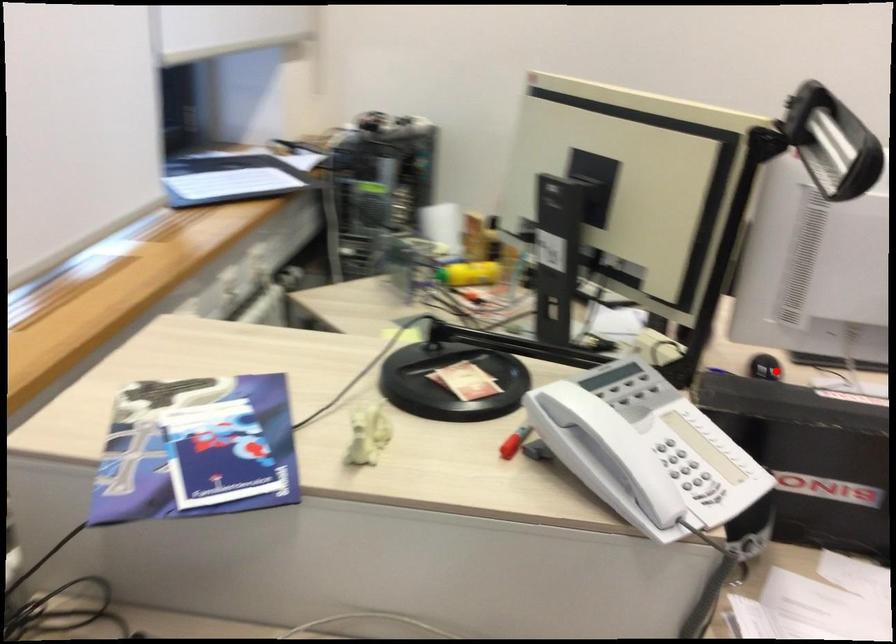
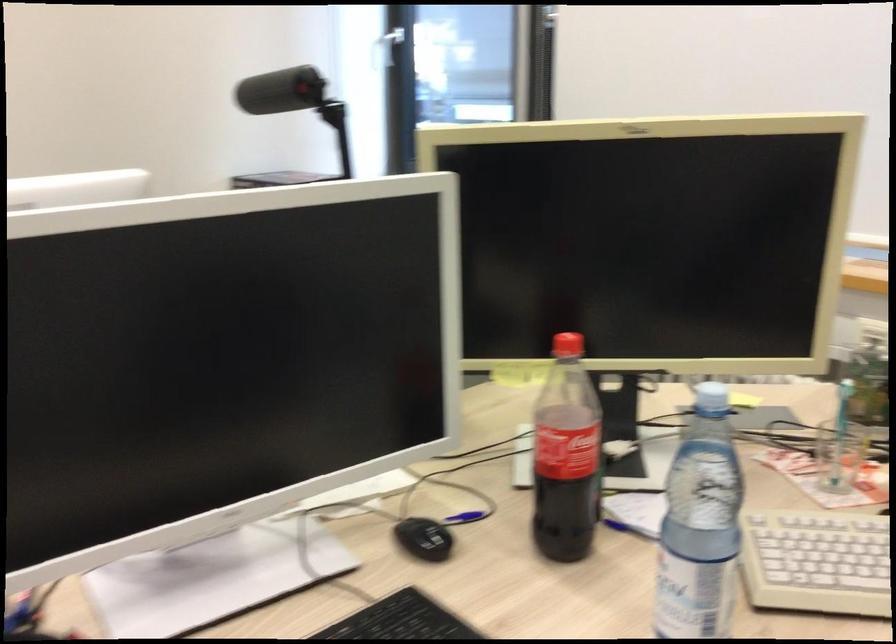
Question: I am providing you with two images of the same scene from different viewpoints. Image1 has a red point marked. In image2, the corresponding 3D location appears at what relative position? Reply with the corresponding letter.

Choices:
 (A) Closer
 (B) Farther

Answer: (A)